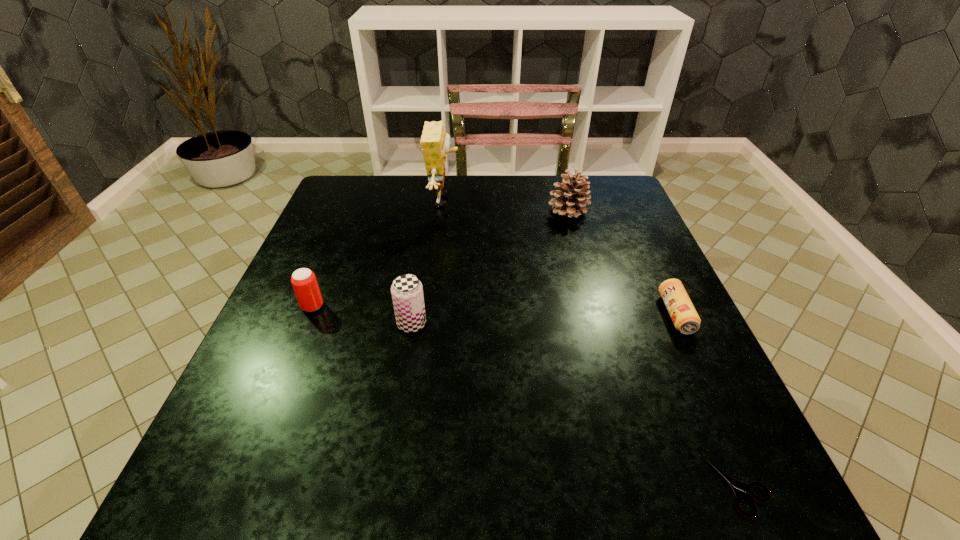
Identify the location of free space located on the back of the pinecone. The height and width of the screenshot is (540, 960). (560, 181).

This screenshot has width=960, height=540. In order to click on free spot located 0.130m on the back of the second beer can from left to right in this screenshot , I will do tap(420, 273).

Where is `free point located on the back of the fourth tallest object`? This screenshot has width=960, height=540. free point located on the back of the fourth tallest object is located at coordinates (331, 260).

Locate an element on the screen. The height and width of the screenshot is (540, 960). vacant space located 0.210m on the left of the rightmost beer can is located at coordinates (562, 314).

At what (x,y) coordinates should I click in order to perform the action: click on vacant point located 0.080m on the back of the shears. Please return your answer as a coordinate pair (x, y). Looking at the image, I should click on (708, 413).

Image resolution: width=960 pixels, height=540 pixels. I want to click on sponge present at the far edge, so click(x=435, y=143).

Locate an element on the screen. pinecone present at the far edge is located at coordinates (571, 200).

Locate an element on the screen. object that is at the near edge is located at coordinates (739, 488).

Where is `object present at the left edge`? This screenshot has width=960, height=540. object present at the left edge is located at coordinates 304,282.

At what (x,y) coordinates should I click in order to perform the action: click on pinecone that is positioned at the right edge. Please return your answer as a coordinate pair (x, y). This screenshot has height=540, width=960. Looking at the image, I should click on (571, 200).